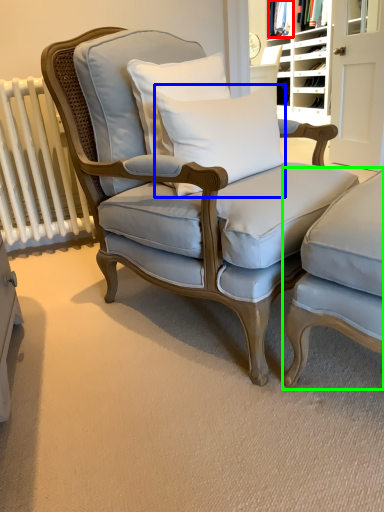
Question: Considering the real-world distances, which object is closest to fabric (highlighted by a red box)? pillow (highlighted by a blue box) or chair (highlighted by a green box).

Choices:
 (A) pillow
 (B) chair

Answer: (A)